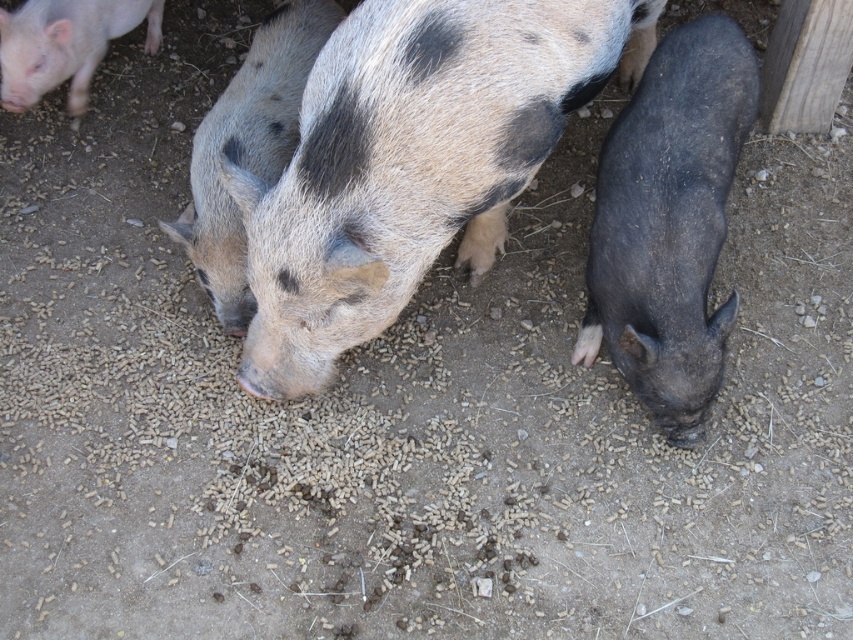
Which of these two, shiny black piglet at right or speckled fur piglet at center, stands taller?

Standing taller between the two is shiny black piglet at right.

Can you confirm if shiny black piglet at right is smaller than speckled fur piglet at center?

Yes, shiny black piglet at right is smaller than speckled fur piglet at center.

What are the coordinates of `shiny black piglet at right` in the screenshot? It's located at (669, 221).

Is speckled fur pig at center below matte pink piglet at upper left?

Yes.

At what (x,y) coordinates should I click in order to perform the action: click on speckled fur pig at center. Please return your answer as a coordinate pair (x, y). This screenshot has height=640, width=853. Looking at the image, I should click on (412, 161).

Between point (316, 371) and point (0, 17), which one is positioned behind?

The point (0, 17) is behind.

Where is `speckled fur pig at center`? speckled fur pig at center is located at coordinates (412, 161).

Can you confirm if speckled fur pig at center is bigger than speckled fur piglet at center?

Correct, speckled fur pig at center is larger in size than speckled fur piglet at center.

Can you confirm if speckled fur pig at center is taller than speckled fur piglet at center?

Yes, speckled fur pig at center is taller than speckled fur piglet at center.

Does point (483, 19) come closer to viewer compared to point (248, 99)?

Yes.

At what (x,y) coordinates should I click in order to perform the action: click on speckled fur pig at center. Please return your answer as a coordinate pair (x, y). This screenshot has height=640, width=853. Looking at the image, I should click on (412, 161).